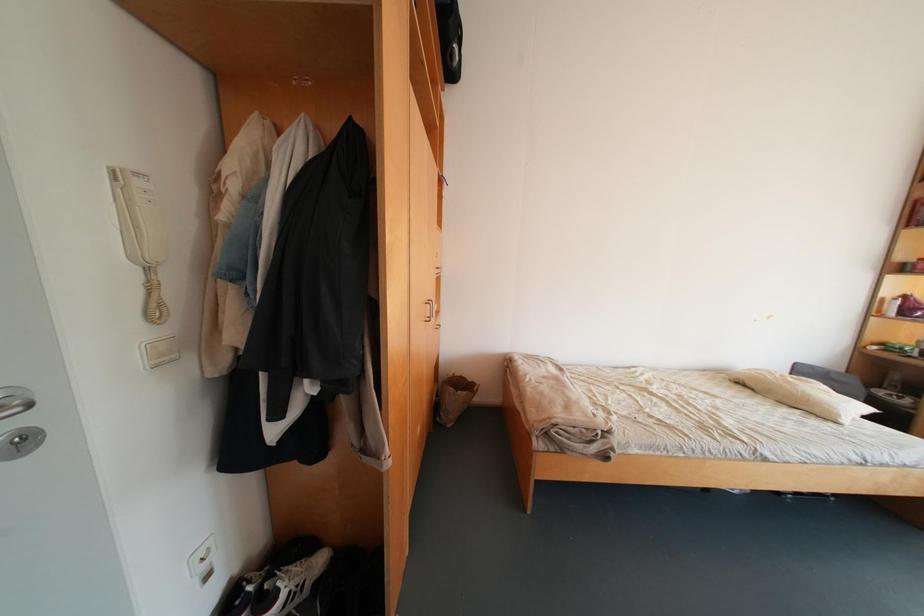
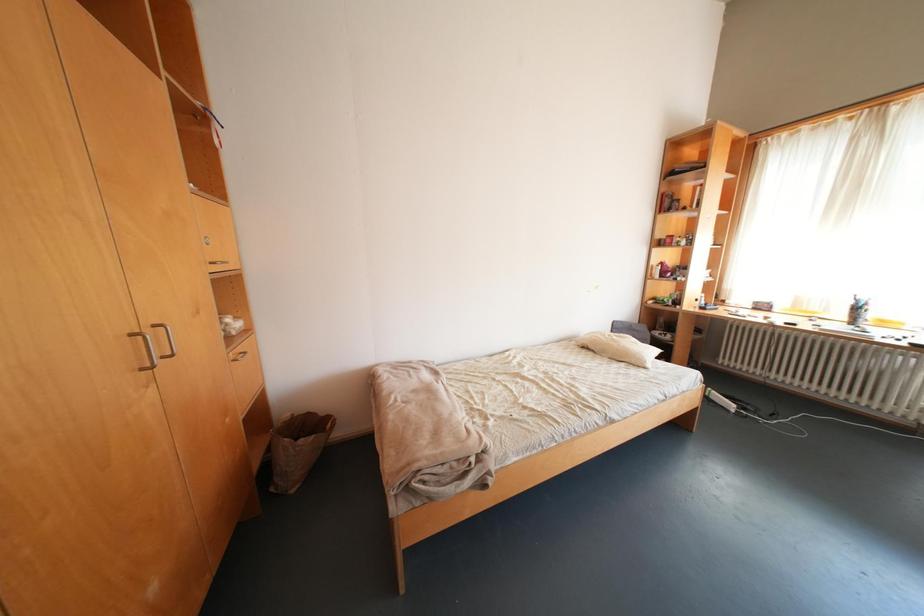
Question: The images are taken continuously from a first-person perspective. In which direction is your viewpoint rotating?

Choices:
 (A) Left
 (B) Right
 (C) Up
 (D) Down

Answer: (B)